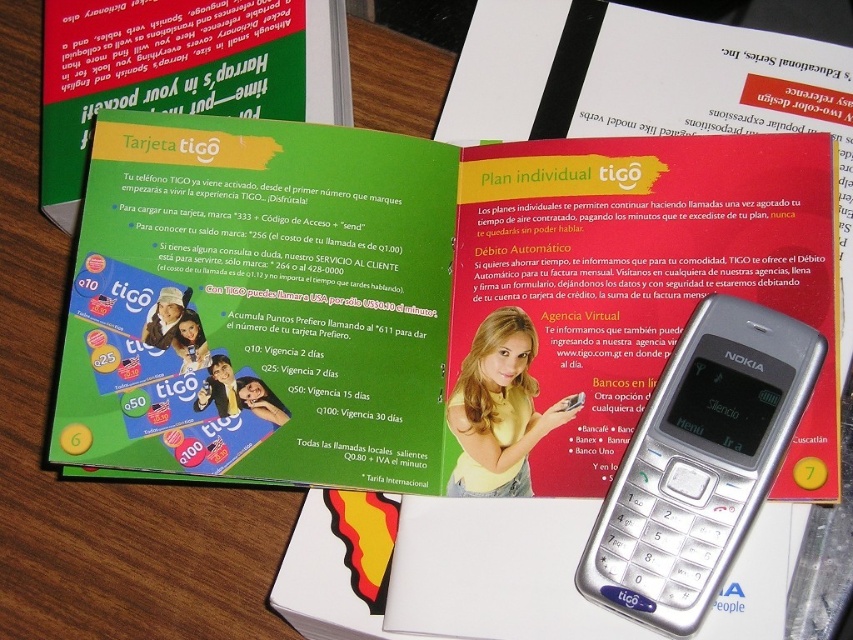
You are a photographer trying to capture a closeup of the booklet. You have two points marked on the booklet, point [619,406] and point [74,116]. Which point should you focus on to get a clearer image of the booklet?

Point [619,406] is closer to the camera than point [74,116], so focusing on point [619,406] will provide a clearer image of the booklet.